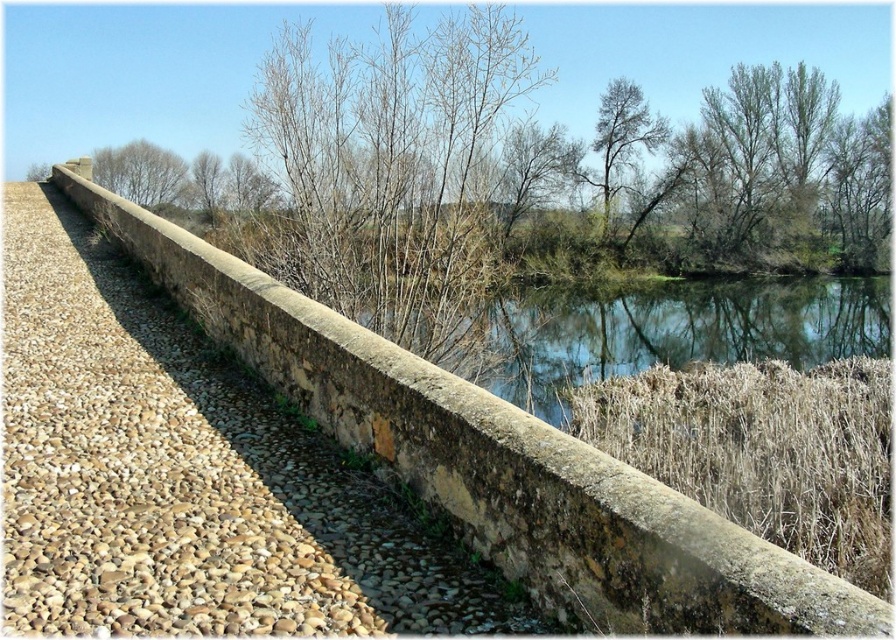
Question: Is greenish-blue water at center to the left of brown wood tree at upper left from the viewer's perspective?

Choices:
 (A) no
 (B) yes

Answer: (A)

Question: Is greenish-blue water at center below green leafy tree at upper center?

Choices:
 (A) no
 (B) yes

Answer: (B)

Question: Which point is closer to the camera?

Choices:
 (A) green leafy tree at upper center
 (B) greenish-blue water at center
 (C) stone wall at center

Answer: (C)

Question: Can you confirm if stone wall at center is smaller than brown wood tree at upper left?

Choices:
 (A) no
 (B) yes

Answer: (B)

Question: Among these objects, which one is nearest to the camera?

Choices:
 (A) brown leafless tree at upper center
 (B) green leafy tree at upper center
 (C) stone wall at center
 (D) greenish-blue water at center

Answer: (C)

Question: Which of the following is the farthest from the observer?

Choices:
 (A) greenish-blue water at center
 (B) stone wall at center
 (C) brown leafless tree at upper center
 (D) brown wood tree at upper left

Answer: (D)